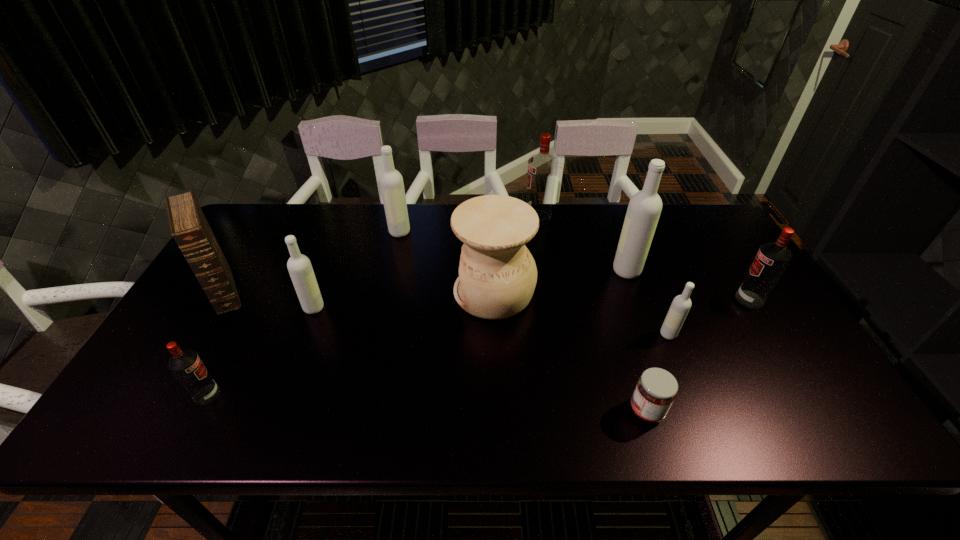
I want to click on free spot at the far edge of the desktop, so click(624, 211).

I want to click on blank space at the near edge, so click(x=537, y=433).

Find the location of a particular element. The height and width of the screenshot is (540, 960). free point at the left edge is located at coordinates (251, 285).

Where is `vacant space at the right edge of the desktop`? vacant space at the right edge of the desktop is located at coordinates (710, 253).

What are the coordinates of `free region at the far right corner of the desktop` in the screenshot? It's located at (703, 229).

Find the location of a particular element. blank region between the eighth farthest object and the rightmost red vodka is located at coordinates coord(708,317).

The height and width of the screenshot is (540, 960). What are the coordinates of `free area in between the sixth vodka from right to left and the farthest white vodka` in the screenshot? It's located at (357, 269).

Image resolution: width=960 pixels, height=540 pixels. I want to click on free space between the eighth farthest object and the leftmost white vodka, so click(x=492, y=321).

Locate an element on the screen. Image resolution: width=960 pixels, height=540 pixels. blank region between the eighth object from right to left and the third smallest white vodka is located at coordinates (357, 269).

Image resolution: width=960 pixels, height=540 pixels. What are the coordinates of `free space between the shortest object and the fourth vodka from left to right` in the screenshot? It's located at (592, 314).